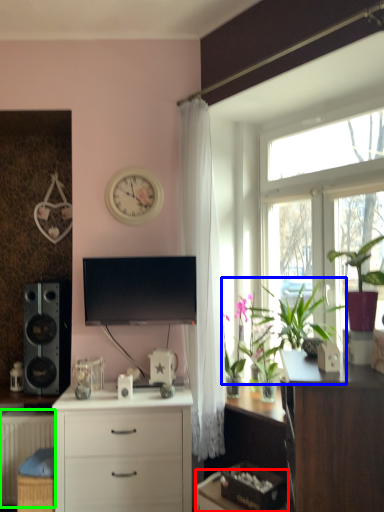
Question: Based on their relative distances, which object is nearer to desk (highlighted by a red box)? Choose from plant (highlighted by a blue box) and radiator (highlighted by a green box).

Choices:
 (A) plant
 (B) radiator

Answer: (A)